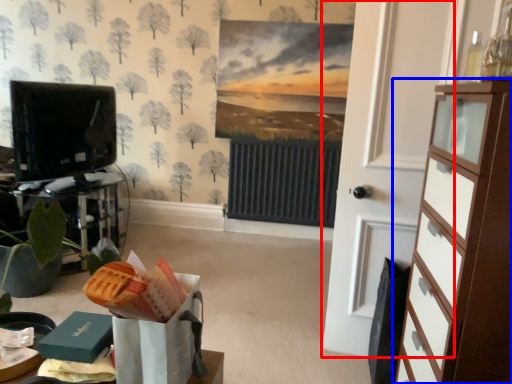
Question: Which object appears farthest to the camera in this image, door (highlighted by a red box) or chest of drawers (highlighted by a blue box)?

Choices:
 (A) door
 (B) chest of drawers

Answer: (A)